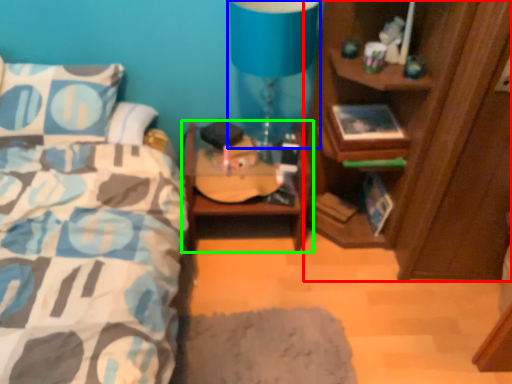
Question: Estimate the real-world distances between objects in this image. Which object is farther from cabinetry (highlighted by a red box), table lamp (highlighted by a blue box) or nightstand (highlighted by a green box)?

Choices:
 (A) table lamp
 (B) nightstand

Answer: (A)